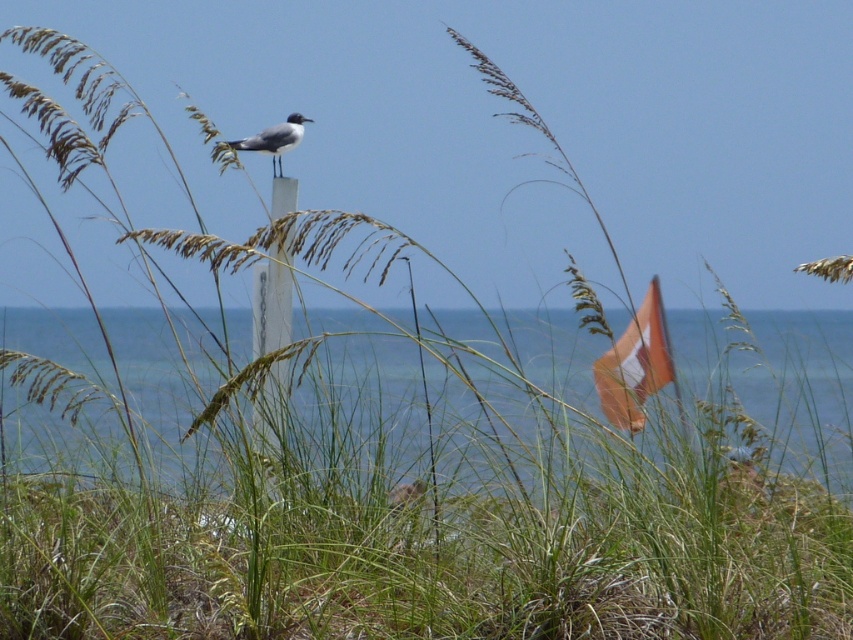
Question: Which of the following is the farthest from the observer?

Choices:
 (A) white glossy bird at center
 (B) orange fabric flag at right
 (C) white plastic pole at center

Answer: (A)

Question: Does blue water at center have a smaller size compared to white glossy bird at center?

Choices:
 (A) yes
 (B) no

Answer: (B)

Question: Does blue water at center come in front of white glossy bird at center?

Choices:
 (A) no
 (B) yes

Answer: (B)

Question: Which object is positioned closest to the white glossy bird at center?

Choices:
 (A) white plastic pole at center
 (B) blue water at center

Answer: (A)

Question: Which object is farther from the camera taking this photo?

Choices:
 (A) white glossy bird at center
 (B) blue water at center
 (C) white plastic pole at center
 (D) orange fabric flag at right

Answer: (A)

Question: Can you confirm if orange fabric flag at right is wider than white glossy bird at center?

Choices:
 (A) yes
 (B) no

Answer: (A)